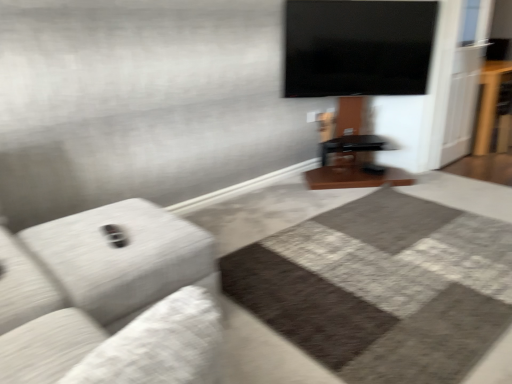
Image resolution: width=512 pixels, height=384 pixels. In order to click on brown wooden table at right in this screenshot , I will do `click(489, 102)`.

What do you see at coordinates (489, 102) in the screenshot? I see `brown wooden table at right` at bounding box center [489, 102].

What do you see at coordinates (110, 299) in the screenshot? The width and height of the screenshot is (512, 384). I see `light gray fabric couch at left` at bounding box center [110, 299].

In order to face light gray fabric couch at left, should I rotate leftwards or rightwards?

Rotate left and turn 17.270 degrees.

Identify the location of light gray fabric couch at left. (110, 299).

The height and width of the screenshot is (384, 512). I want to click on brown wooden table at right, so click(489, 102).

Considering the relative positions of brown wooden table at right and light gray fabric couch at left in the image provided, is brown wooden table at right to the right of light gray fabric couch at left from the viewer's perspective?

Yes, brown wooden table at right is to the right of light gray fabric couch at left.

Between brown wooden table at right and light gray fabric couch at left, which one is positioned in front?

light gray fabric couch at left is in front.

Is point (482, 79) closer to viewer compared to point (159, 373)?

No, it is not.

From the image's perspective, between brown wooden table at right and light gray fabric couch at left, who is located below?

light gray fabric couch at left appears lower in the image.

From a real-world perspective, is brown wooden table at right on top of light gray fabric couch at left?

Correct, in the physical world, brown wooden table at right is higher than light gray fabric couch at left.

In terms of width, does brown wooden table at right look wider or thinner when compared to light gray fabric couch at left?

In the image, brown wooden table at right appears to be more narrow than light gray fabric couch at left.

Consider the image. Does brown wooden table at right have a lesser height compared to light gray fabric couch at left?

Incorrect, the height of brown wooden table at right does not fall short of that of light gray fabric couch at left.

Is brown wooden table at right bigger or smaller than light gray fabric couch at left?

Considering their sizes, brown wooden table at right takes up more space than light gray fabric couch at left.

Is brown wooden table at right inside or outside of light gray fabric couch at left?

brown wooden table at right is not enclosed by light gray fabric couch at left.

Are brown wooden table at right and light gray fabric couch at left beside each other?

brown wooden table at right and light gray fabric couch at left are not in contact.

Could you tell me if brown wooden table at right is facing light gray fabric couch at left?

No, brown wooden table at right is not aimed at light gray fabric couch at left.

In the image, there is a light gray fabric couch at left. Identify the location of table above it (from the image's perspective). (489, 102).

Can you confirm if light gray fabric couch at left is positioned to the right of brown wooden table at right?

In fact, light gray fabric couch at left is to the left of brown wooden table at right.

Is light gray fabric couch at left positioned before brown wooden table at right?

That is True.

Does point (167, 245) appear closer or farther from the camera than point (486, 116)?

Clearly, point (167, 245) is closer to the camera than point (486, 116).

From the image's perspective, does light gray fabric couch at left appear lower than brown wooden table at right?

Yes, from the image's perspective, light gray fabric couch at left is beneath brown wooden table at right.

From a real-world perspective, between light gray fabric couch at left and brown wooden table at right, who is vertically lower?

light gray fabric couch at left, from a real-world perspective.

Looking at their sizes, would you say light gray fabric couch at left is wider or thinner than brown wooden table at right?

Considering their sizes, light gray fabric couch at left looks broader than brown wooden table at right.

In terms of height, does light gray fabric couch at left look taller or shorter compared to brown wooden table at right?

light gray fabric couch at left is shorter than brown wooden table at right.

Does light gray fabric couch at left have a smaller size compared to brown wooden table at right?

Indeed, light gray fabric couch at left has a smaller size compared to brown wooden table at right.

Could brown wooden table at right be considered to be inside light gray fabric couch at left?

That's incorrect, brown wooden table at right is not inside light gray fabric couch at left.

Is light gray fabric couch at left next to brown wooden table at right and touching it?

light gray fabric couch at left is not next to brown wooden table at right, and they're not touching.

Is light gray fabric couch at left positioned with its back to brown wooden table at right?

No, light gray fabric couch at left's orientation is not away from brown wooden table at right.

Can you tell me how much light gray fabric couch at left and brown wooden table at right differ in facing direction?

light gray fabric couch at left and brown wooden table at right are facing 90.6 degrees away from each other.

The image size is (512, 384). Find the location of `table on the right of light gray fabric couch at left`. table on the right of light gray fabric couch at left is located at coordinates (489, 102).

There is a light gray fabric couch at left. At what (x,y) coordinates should I click in order to perform the action: click on table above it (from a real-world perspective). Please return your answer as a coordinate pair (x, y). Looking at the image, I should click on click(x=489, y=102).

This screenshot has height=384, width=512. Find the location of `studio couch that appears below the brown wooden table at right (from a real-world perspective)`. studio couch that appears below the brown wooden table at right (from a real-world perspective) is located at coordinates click(110, 299).